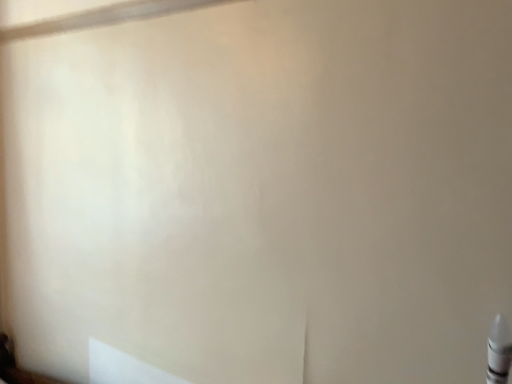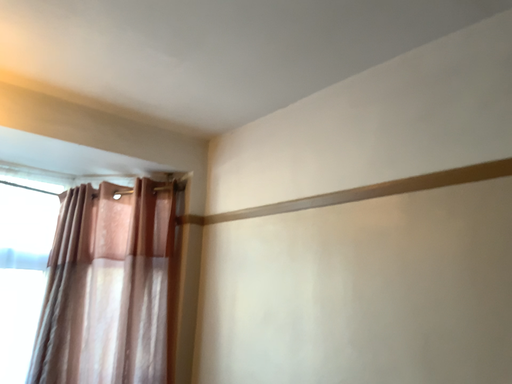
Question: Which way did the camera rotate in the video?

Choices:
 (A) rotated left
 (B) rotated right

Answer: (A)